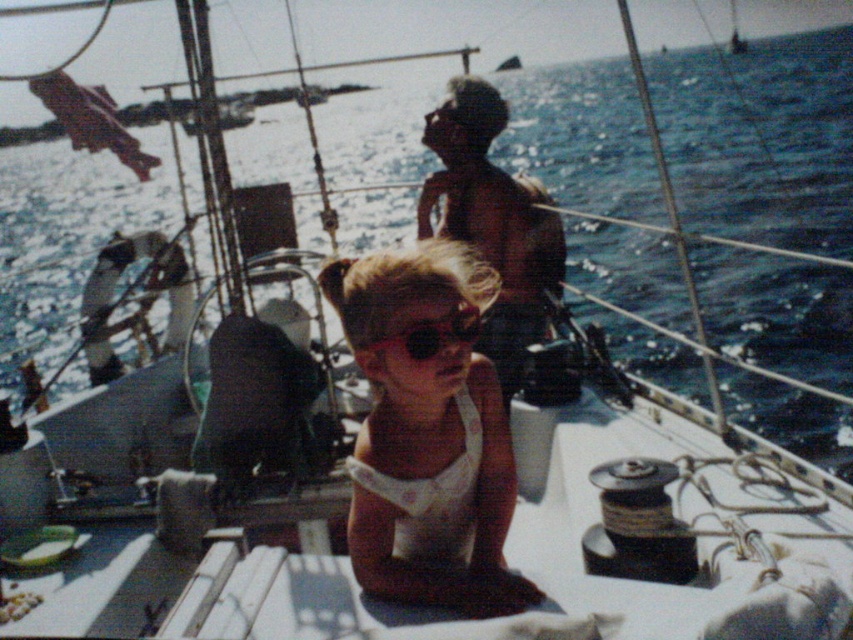
Question: Is the position of white fabric dress at center less distant than that of black matte goggles at center?

Choices:
 (A) yes
 (B) no

Answer: (B)

Question: Is white fabric dress at center wider than black matte goggles at center?

Choices:
 (A) yes
 (B) no

Answer: (A)

Question: Does white fabric dress at center have a smaller size compared to brown skin at upper center?

Choices:
 (A) yes
 (B) no

Answer: (A)

Question: Which object is the closest to the black matte goggles at center?

Choices:
 (A) white fabric dress at center
 (B) brown skin at upper center

Answer: (A)

Question: Which object is farther from the camera taking this photo?

Choices:
 (A) black matte goggles at center
 (B) brown skin at upper center
 (C) white fabric dress at center

Answer: (B)

Question: Among these points, which one is nearest to the camera?

Choices:
 (A) (347, 304)
 (B) (415, 337)

Answer: (B)